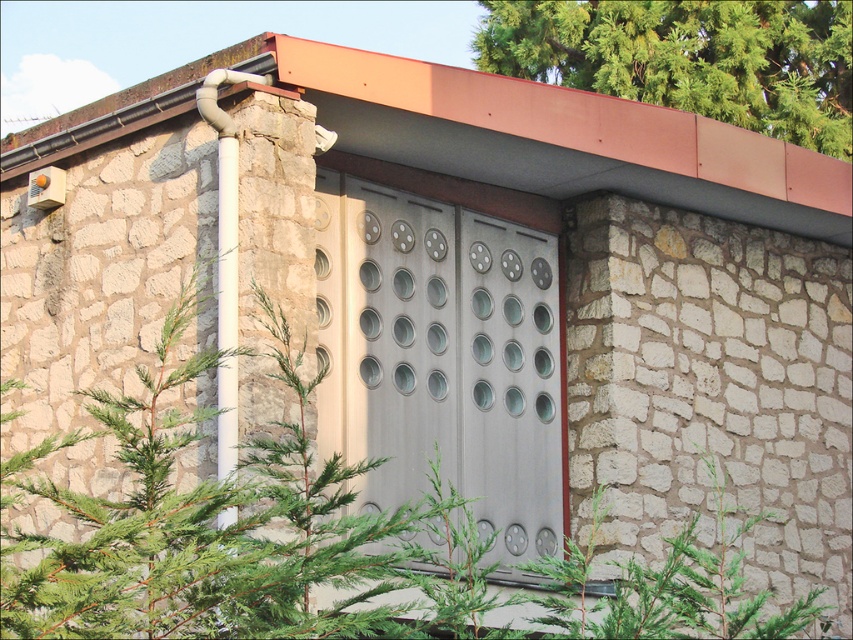
You are a painter who needs to paint both the green leafy tree at center and the white pipe on the left. You have a ladder that can reach up to 8 meters. Can you safely paint both objects without needing a taller ladder?

The distance between the green leafy tree at center and the white pipe on the left is 8.17 meters. Since your ladder can only reach up to 8 meters, you cannot safely paint both objects without needing a taller ladder.

You are a window installer who needs to determine which green leafy tree is taller. You see the green leafy tree at center and the green leafy tree at upper right. Which one is taller?

The green leafy tree at center has a greater height compared to the green leafy tree at upper right, so the green leafy tree at center is taller.

You are a window installer assessing the exterior wall. You need to install a new window between the green leafy tree at center and the green leafy tree at upper right. Which tree should you avoid placing the window near to ensure it doesn t block the view of the larger tree?

You should avoid placing the window near the green leafy tree at center because it is bigger than the green leafy tree at upper right, so blocking it would obstruct the view of the larger tree.